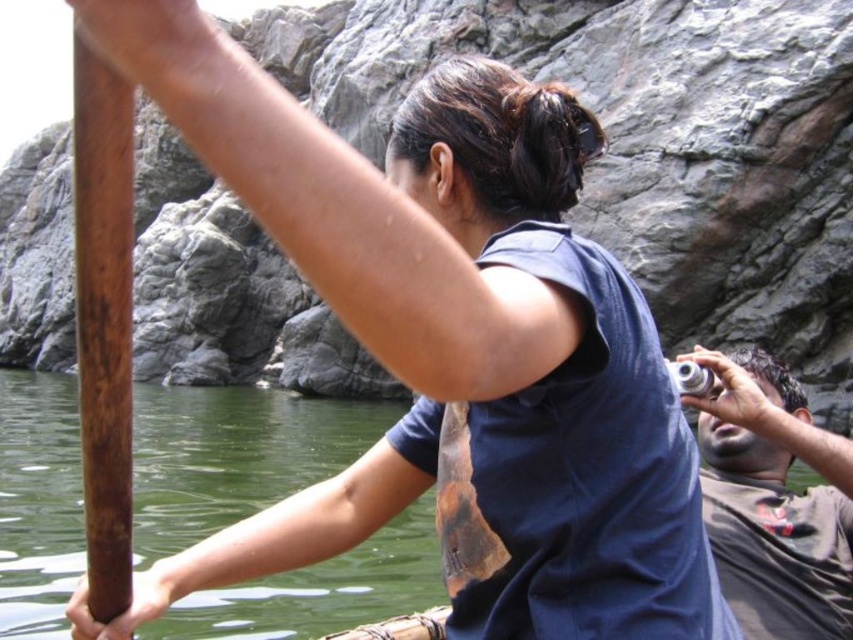
You are a photographer trying to capture the scene of two people on a water activity. You notice the dark brown leather camera at right and the brown wooden pole at left. Which object is closer to you?

The dark brown leather camera at right is closer to you because it is further to the viewer than the brown wooden pole at left.

You are participating in a water activity and need to reach the brown wooden pole at left to adjust your position. However, there is a dark brown leather camera at right in your path. Based on their positions, can you safely reach the pole without disturbing the camera?

The dark brown leather camera at right is below the brown wooden pole at left, so reaching the pole should not disturb the camera as they are positioned at different heights.